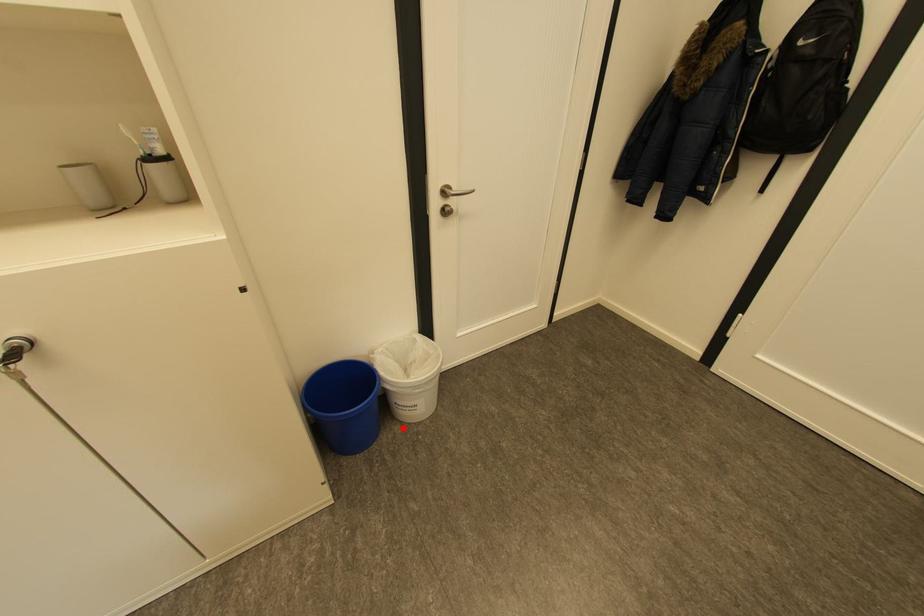
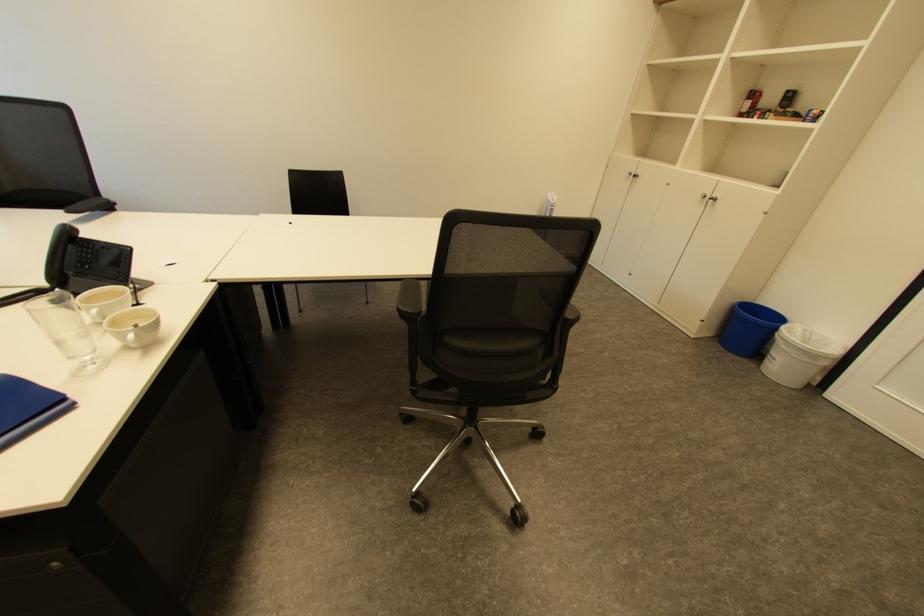
Question: A red point is marked in image1. In image2, is the corresponding 3D point closer to the camera or farther? Reply with the corresponding letter.

Choices:
 (A) The corresponding 3D point is closer.
 (B) The corresponding 3D point is farther.

Answer: (A)